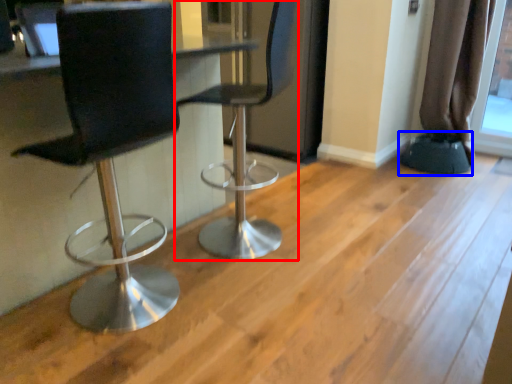
Question: Among these objects, which one is farthest to the camera, chair (highlighted by a red box) or step stool (highlighted by a blue box)?

Choices:
 (A) chair
 (B) step stool

Answer: (B)